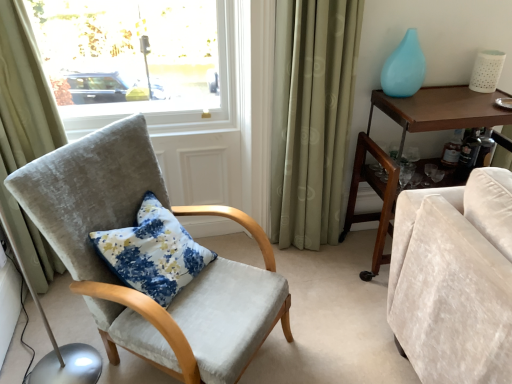
Question: Is beige fabric curtain at left, which is the first curtain from left to right, in front of or behind brown wood desk at right in the image?

Choices:
 (A) front
 (B) behind

Answer: (A)

Question: Based on their positions, is beige fabric curtain at left, arranged as the 2th curtain when viewed from the right, located to the left or right of brown wood desk at right?

Choices:
 (A) left
 (B) right

Answer: (A)

Question: Estimate the real-world distances between objects in this image. Which object is closer to the brown wood desk at right?

Choices:
 (A) green fabric curtain at center, which is counted as the second curtain, starting from the left
 (B) velvet cushioned chair at left
 (C) light blue glass vase at upper right
 (D) floral fabric cushion at center
 (E) beige fabric curtain at left, arranged as the 2th curtain when viewed from the right

Answer: (A)

Question: Which is nearer to the velvet cushioned chair at left?

Choices:
 (A) floral fabric cushion at center
 (B) light blue glass vase at upper right
 (C) brown wood desk at right
 (D) green fabric curtain at center, which is counted as the second curtain, starting from the left
 (E) beige fabric curtain at left, which is the first curtain from left to right

Answer: (A)